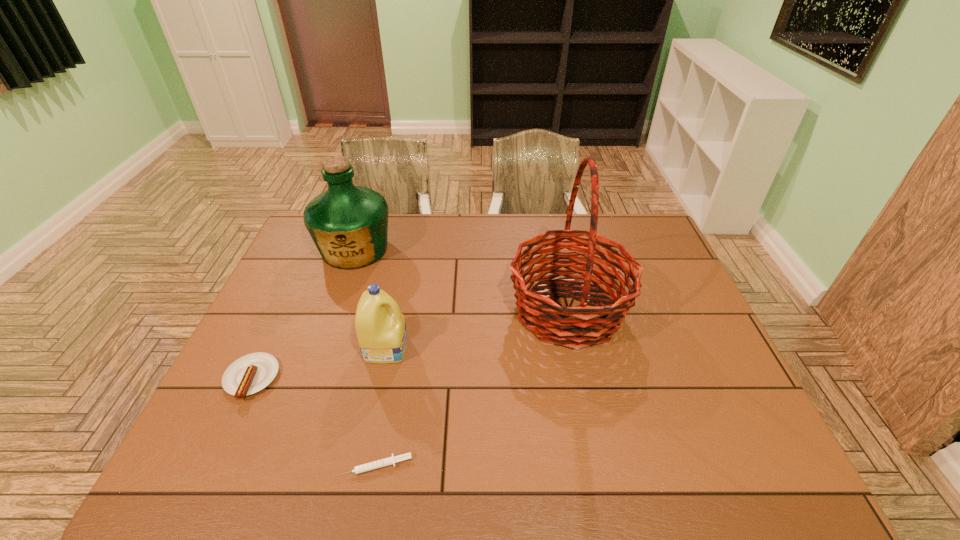
Locate an element on the screen. The image size is (960, 540). the rightmost object is located at coordinates (584, 325).

Find the location of `basket`. basket is located at coordinates (584, 325).

At what (x,y) coordinates should I click in order to perform the action: click on the fourth shortest object. Please return your answer as a coordinate pair (x, y). Image resolution: width=960 pixels, height=540 pixels. Looking at the image, I should click on (349, 224).

Identify the location of detergent. The image size is (960, 540). (381, 332).

What are the coordinates of `the second shortest object` in the screenshot? It's located at (251, 373).

At what (x,y) coordinates should I click in order to perform the action: click on syringe. Please return your answer as a coordinate pair (x, y). The image size is (960, 540). Looking at the image, I should click on (388, 461).

You are a GUI agent. You are given a task and a screenshot of the screen. Output one action in this format:
    pyautogui.click(x=<x>, y=<y>)
    Task: Click on the shortest object
    This screenshot has width=960, height=540.
    Given the screenshot: What is the action you would take?
    pyautogui.click(x=388, y=461)

Locate an element on the screen. free space located 0.190m on the left of the basket is located at coordinates (443, 310).

Identify the location of blank space located on the label side of the liquor. (321, 349).

Image resolution: width=960 pixels, height=540 pixels. In order to click on blank space located on the label of the detergent in this screenshot , I will do `click(509, 347)`.